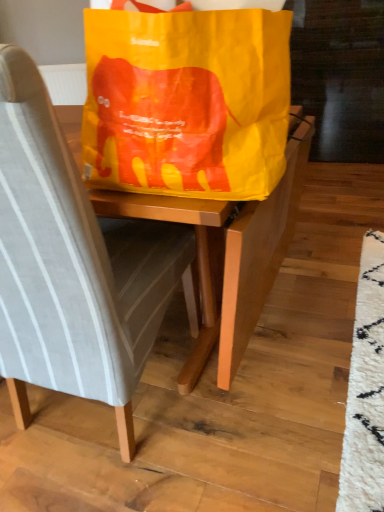
Find the location of a particular element. vacant space underneath yellow paper grocery bag at center (from a real-world perspective) is located at coordinates (212, 388).